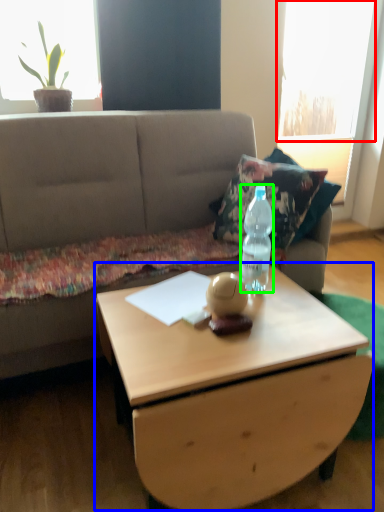
Question: Which object is positioned closest to window (highlighted by a red box)? Select from coffee table (highlighted by a blue box) and bottle (highlighted by a green box).

Choices:
 (A) coffee table
 (B) bottle

Answer: (B)